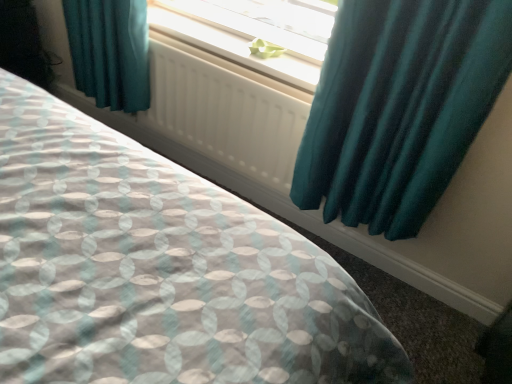
This screenshot has height=384, width=512. In order to click on vacant region above white plastic radiator at upper center (from a real-world perspective) in this screenshot , I will do 221,38.